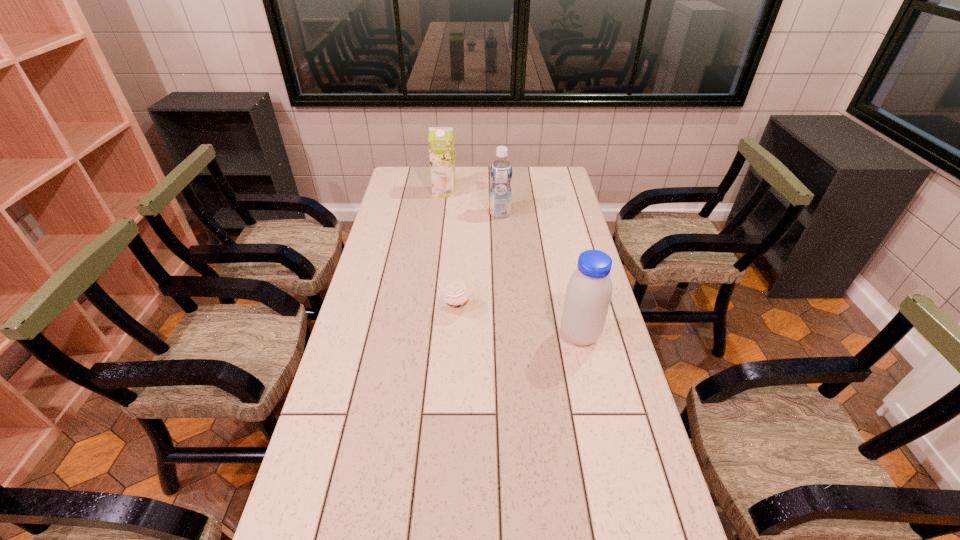
Find the location of a particular element. free space between the farthest object and the nearest object is located at coordinates (512, 264).

The width and height of the screenshot is (960, 540). Find the location of `empty location between the second nearest soya milk and the rightmost soya milk`. empty location between the second nearest soya milk and the rightmost soya milk is located at coordinates (540, 274).

Find the location of a particular element. free point between the third object from left to right and the shortest object is located at coordinates (478, 261).

The height and width of the screenshot is (540, 960). In order to click on unoccupied area between the third nearest object and the shortest object in this screenshot , I will do `click(478, 261)`.

Locate an element on the screen. This screenshot has height=540, width=960. vacant region between the second soya milk from left to right and the leftmost soya milk is located at coordinates (472, 202).

Where is `vacant space that's between the second soya milk from right to left and the farthest object`? The image size is (960, 540). vacant space that's between the second soya milk from right to left and the farthest object is located at coordinates (472, 202).

Locate an element on the screen. This screenshot has height=540, width=960. vacant point located between the farthest object and the second soya milk from right to left is located at coordinates (472, 202).

I want to click on free spot between the farthest object and the third nearest object, so click(472, 202).

This screenshot has width=960, height=540. I want to click on vacant space that is in between the nearest object and the second object from right to left, so click(x=540, y=274).

Select which object appears as the closest to the second object from right to left. Please provide its 2D coordinates. Your answer should be formatted as a tuple, i.e. [(x, y)], where the tuple contains the x and y coordinates of a point satisfying the conditions above.

[(441, 139)]